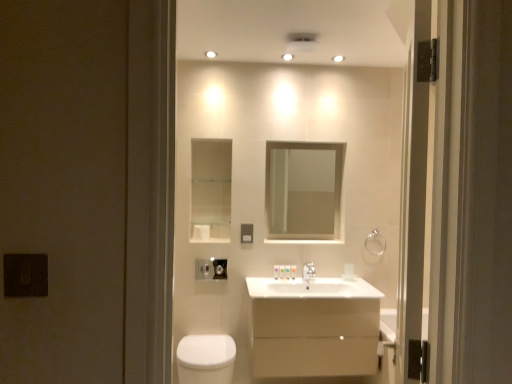
The height and width of the screenshot is (384, 512). What do you see at coordinates (308, 272) in the screenshot?
I see `satin nickel faucet at center` at bounding box center [308, 272].

The height and width of the screenshot is (384, 512). Find the location of `translucent plastic tube at center, placed as the 1th toiletry when sorted from left to right`. translucent plastic tube at center, placed as the 1th toiletry when sorted from left to right is located at coordinates (276, 272).

What is the approximate height of matte silver outlet at center?

matte silver outlet at center is 5.75 inches tall.

This screenshot has height=384, width=512. Identify the location of matte silver outlet at center. (246, 233).

Describe the element at coordinates (293, 271) in the screenshot. The height and width of the screenshot is (384, 512). I see `white glossy toiletries at center, the second toiletry viewed from the left` at that location.

The height and width of the screenshot is (384, 512). Identify the location of white matte toilet paper at center. (201, 232).

Locate an element on the screen. satin nickel faucet at center is located at coordinates (308, 272).

From a real-world perspective, does clear glass mirror at upper center stand above black metal screen door at right?

Yes, from a real-world perspective, clear glass mirror at upper center is above black metal screen door at right.

Is clear glass mirror at upper center inside the boundaries of black metal screen door at right, or outside?

clear glass mirror at upper center is outside black metal screen door at right.

The image size is (512, 384). What are the coordinates of `mirror that is on the left side of black metal screen door at right` in the screenshot? It's located at (303, 190).

Does point (286, 150) come behind point (414, 128)?

That is True.

From a real-world perspective, is white glossy toilet at lower left physically located above or below white glossy toiletries at center, acting as the 1th toiletry starting from the right?

In terms of real-world spatial position, white glossy toilet at lower left is below white glossy toiletries at center, acting as the 1th toiletry starting from the right.

From the image's perspective, which is below, white glossy toilet at lower left or white glossy toiletries at center, the second toiletry viewed from the left?

From the image's view, white glossy toilet at lower left is below.

Which object is wider, white glossy toilet at lower left or white glossy toiletries at center, the second toiletry viewed from the left?

white glossy toilet at lower left.

Considering the relative positions of white glossy toilet at lower left and white glossy toiletries at center, acting as the 1th toiletry starting from the right, in the image provided, is white glossy toilet at lower left to the right of white glossy toiletries at center, acting as the 1th toiletry starting from the right, from the viewer's perspective?

No.

Considering the positions of objects translucent plastic tube at center, placed as the 1th toiletry when sorted from left to right, and black metal screen door at right in the image provided, who is more to the right, translucent plastic tube at center, placed as the 1th toiletry when sorted from left to right, or black metal screen door at right?

black metal screen door at right is more to the right.

You are a GUI agent. You are given a task and a screenshot of the screen. Output one action in this format:
    pyautogui.click(x=<x>, y=<y>)
    Task: Click on the screen door above the translucent plastic tube at center, acting as the second toiletry starting from the right (from the image's perspective)
    
    Given the screenshot: What is the action you would take?
    point(413,203)

Considering the sizes of objects translucent plastic tube at center, placed as the 1th toiletry when sorted from left to right, and black metal screen door at right in the image provided, who is wider, translucent plastic tube at center, placed as the 1th toiletry when sorted from left to right, or black metal screen door at right?

Wider between the two is black metal screen door at right.

Which is nearer, (294, 270) or (417, 73)?

Point (294, 270) appears to be farther away from the viewer than point (417, 73).

Is white glossy toiletries at center, acting as the 1th toiletry starting from the right, to the left or to the right of black metal screen door at right in the image?

Clearly, white glossy toiletries at center, acting as the 1th toiletry starting from the right, is on the left of black metal screen door at right in the image.

From the image's perspective, who appears lower, white glossy toiletries at center, acting as the 1th toiletry starting from the right, or black metal screen door at right?

white glossy toiletries at center, acting as the 1th toiletry starting from the right, appears lower in the image.

Does matte silver outlet at center contain black metal screen door at right?

Actually, black metal screen door at right is outside matte silver outlet at center.

The image size is (512, 384). There is a matte silver outlet at center. In order to click on screen door above it (from a real-world perspective) in this screenshot , I will do `click(413, 203)`.

How many degrees apart are the facing directions of matte silver outlet at center and black metal screen door at right?

matte silver outlet at center and black metal screen door at right are facing 111 degrees away from each other.

Considering the relative sizes of translucent plastic tube at center, placed as the 1th toiletry when sorted from left to right, and white glossy toilet at lower left in the image provided, is translucent plastic tube at center, placed as the 1th toiletry when sorted from left to right, bigger than white glossy toilet at lower left?

No, translucent plastic tube at center, placed as the 1th toiletry when sorted from left to right, is not bigger than white glossy toilet at lower left.

Locate an element on the screen. The image size is (512, 384). toilet to the left of translucent plastic tube at center, placed as the 1th toiletry when sorted from left to right is located at coordinates (206, 359).

Considering the relative sizes of translucent plastic tube at center, acting as the second toiletry starting from the right, and white glossy toilet at lower left in the image provided, is translucent plastic tube at center, acting as the second toiletry starting from the right, thinner than white glossy toilet at lower left?

Yes.

Considering the sizes of matte silver outlet at center and white glossy toilet at lower left in the image, is matte silver outlet at center bigger or smaller than white glossy toilet at lower left?

matte silver outlet at center is smaller than white glossy toilet at lower left.

Measure the distance between matte silver outlet at center and white glossy toilet at lower left.

matte silver outlet at center and white glossy toilet at lower left are 32.18 inches apart.

How many degrees apart are the facing directions of matte silver outlet at center and white glossy toilet at lower left?

1.14 degrees.

Is matte silver outlet at center in contact with white glossy toilet at lower left?

A: No, matte silver outlet at center is not next to white glossy toilet at lower left.

This screenshot has width=512, height=384. I want to click on mirror above the black metal screen door at right (from the image's perspective), so click(303, 190).

Identify the location of toilet that appears below the white glossy toiletries at center, acting as the 1th toiletry starting from the right (from the image's perspective). The height and width of the screenshot is (384, 512). (206, 359).

Estimate the real-world distances between objects in this image. Which object is closer to white glossy sink at center, white glossy toilet at lower left or white glossy toiletries at center, the second toiletry viewed from the left?

white glossy toiletries at center, the second toiletry viewed from the left, lies closer to white glossy sink at center than the other object.

Considering their positions, is matte silver outlet at center positioned further to satin nickel faucet at center than white glossy cabinet at center?

Among the two, matte silver outlet at center is located further to satin nickel faucet at center.

Based on the photo, estimate the real-world distances between objects in this image. Which object is further from white matte toilet paper at center, white glossy toilet at lower left or white glossy toiletries at center, the second toiletry viewed from the left?

The object further to white matte toilet paper at center is white glossy toilet at lower left.

From the picture: Estimate the real-world distances between objects in this image. Which object is further from white glossy cabinet at center, white glossy toiletries at center, the second toiletry viewed from the left, or translucent plastic tube at center, placed as the 1th toiletry when sorted from left to right?

translucent plastic tube at center, placed as the 1th toiletry when sorted from left to right.

Estimate the real-world distances between objects in this image. Which object is further from white matte toilet paper at center, white glossy toilet at lower left or black metal screen door at right?

black metal screen door at right is further to white matte toilet paper at center.

From the image, which object appears to be farther from white glossy sink at center, satin nickel faucet at center or white matte toilet paper at center?

white matte toilet paper at center.

Looking at the image, which one is located closer to clear glass mirror at upper center, black metal screen door at right or translucent plastic tube at center, placed as the 1th toiletry when sorted from left to right?

Among the two, translucent plastic tube at center, placed as the 1th toiletry when sorted from left to right, is located nearer to clear glass mirror at upper center.

Which object lies further to the anchor point matte silver outlet at center, satin nickel faucet at center or white glossy cabinet at center?

white glossy cabinet at center.

At what (x,y) coordinates should I click in order to perform the action: click on bathroom cabinet located between white glossy sink at center and translucent plastic tube at center, placed as the 1th toiletry when sorted from left to right, in the depth direction. Please return your answer as a coordinate pair (x, y). Image resolution: width=512 pixels, height=384 pixels. Looking at the image, I should click on (313, 327).

Find the location of `electric outlet that lies between clear glass mirror at upper center and white glossy cabinet at center from top to bottom`. electric outlet that lies between clear glass mirror at upper center and white glossy cabinet at center from top to bottom is located at coordinates (246, 233).

This screenshot has width=512, height=384. I want to click on tap between matte silver outlet at center and white glossy cabinet at center from top to bottom, so click(x=308, y=272).

This screenshot has height=384, width=512. What are the coordinates of `toilet between black metal screen door at right and clear glass mirror at upper center in the front-back direction` in the screenshot? It's located at (206, 359).